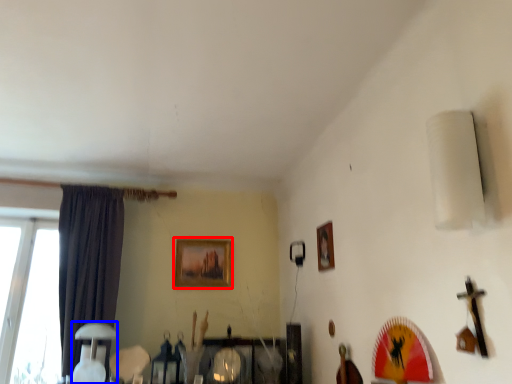
Question: Which object is further to the camera taking this photo, picture frame (highlighted by a red box) or table lamp (highlighted by a blue box)?

Choices:
 (A) picture frame
 (B) table lamp

Answer: (A)